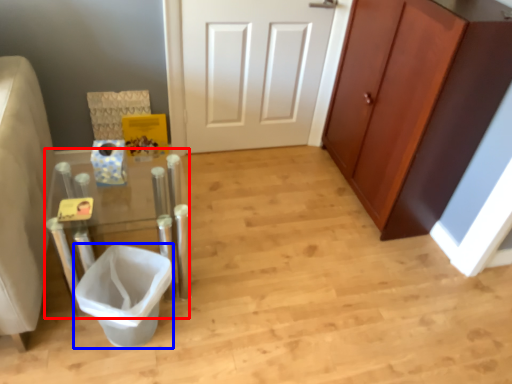
Question: Which point is closer to the camera, vanity (highlighted by a red box) or toilet bowl (highlighted by a blue box)?

Choices:
 (A) vanity
 (B) toilet bowl

Answer: (A)